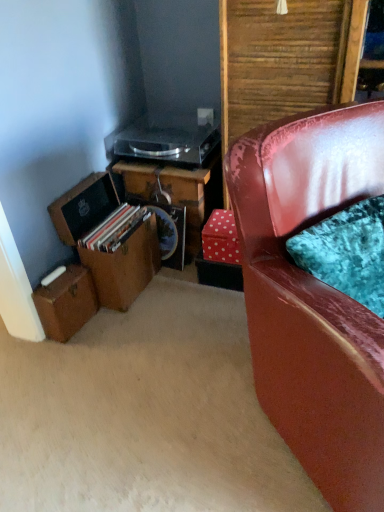
This screenshot has height=512, width=384. Identify the location of free space to the right of brown leather suitcase at lower left, the second box from the bottom. (175, 292).